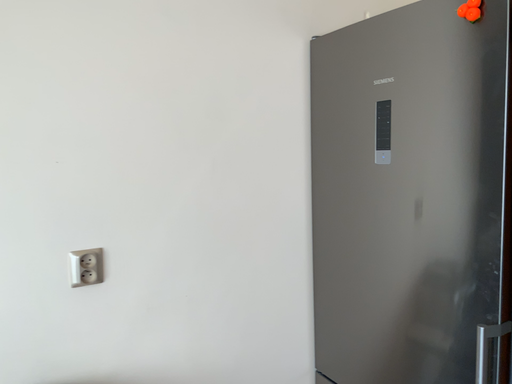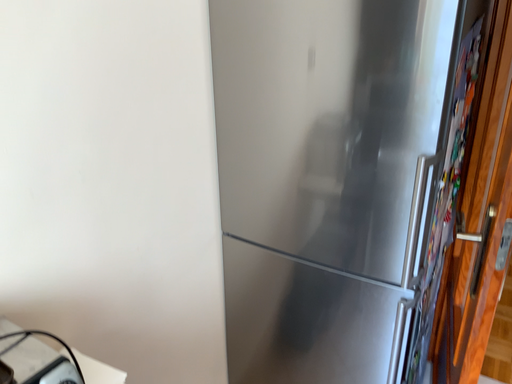
Question: How did the camera likely rotate when shooting the video?

Choices:
 (A) rotated right
 (B) rotated left

Answer: (A)